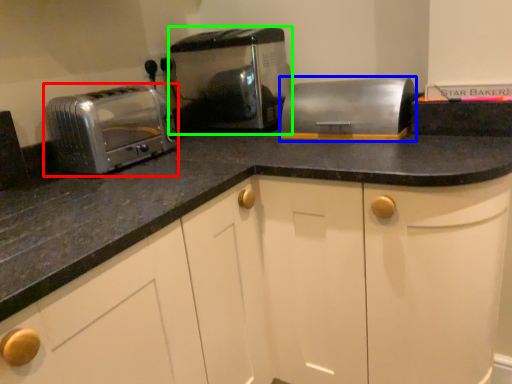
Question: Based on their relative distances, which object is nearer to toaster (highlighted by a red box)? Choose from appliance (highlighted by a blue box) and toaster (highlighted by a green box).

Choices:
 (A) appliance
 (B) toaster

Answer: (B)